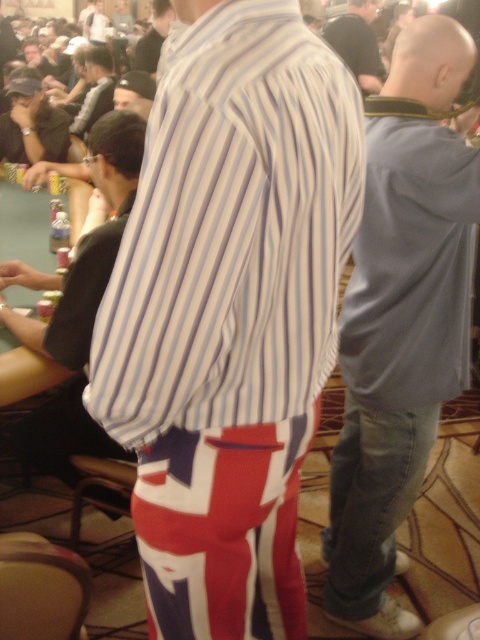
Question: Is light blue denim jeans at right thinner than dark blue shirt at center?

Choices:
 (A) yes
 (B) no

Answer: (A)

Question: Which point is closer to the camera?

Choices:
 (A) (238, 51)
 (B) (29, 128)

Answer: (A)

Question: Is striped cotton shirt at center closer to camera compared to striped shirt at center?

Choices:
 (A) yes
 (B) no

Answer: (A)

Question: Which object is closer to the camera taking this photo?

Choices:
 (A) striped cotton shirt at center
 (B) matte black cap at upper left

Answer: (A)

Question: Which of the following is the closest to the observer?

Choices:
 (A) striped cotton shirt at center
 (B) dark blue shirt at center

Answer: (A)

Question: Can you confirm if dark blue shirt at center is bigger than striped shirt at center?

Choices:
 (A) no
 (B) yes

Answer: (B)